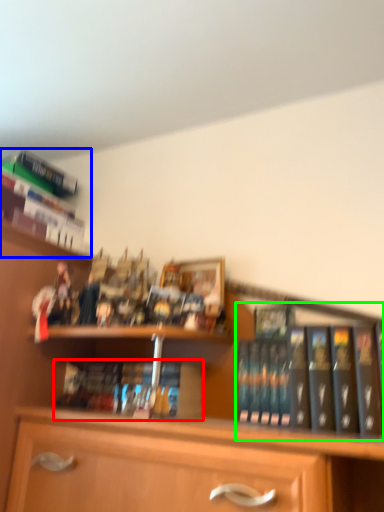
Question: Which object is the closest to the book (highlighted by a red box)? Choose among these: book (highlighted by a blue box) or book (highlighted by a green box).

Choices:
 (A) book
 (B) book

Answer: (B)